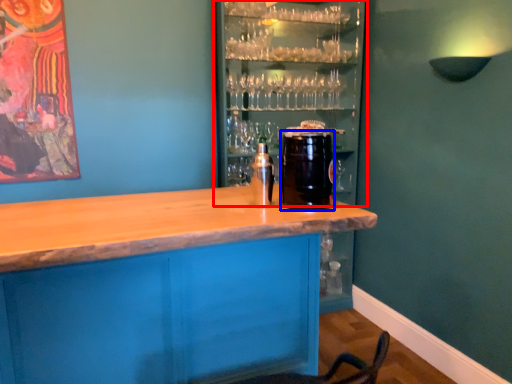
Question: Which object appears farthest to the camera in this image, shelf (highlighted by a red box) or beverage (highlighted by a blue box)?

Choices:
 (A) shelf
 (B) beverage

Answer: (A)